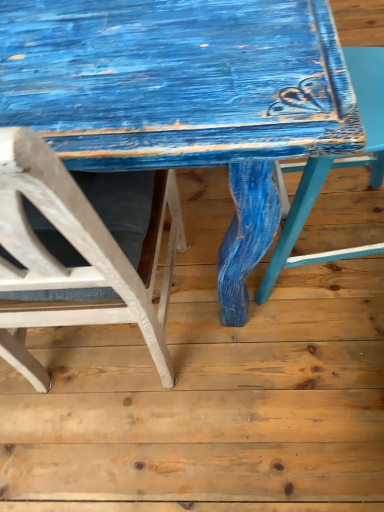
Question: Is matte blue chair at right, which is the first chair in right-to-left order, smaller than distressed blue wood table at center?

Choices:
 (A) yes
 (B) no

Answer: (A)

Question: Is matte blue chair at right, which is the 2th chair from left to right, closer to the viewer compared to distressed blue wood table at center?

Choices:
 (A) no
 (B) yes

Answer: (B)

Question: Does matte blue chair at right, which is the 2th chair from left to right, appear on the left side of distressed blue wood table at center?

Choices:
 (A) no
 (B) yes

Answer: (A)

Question: From the image's perspective, is matte blue chair at right, which is the 2th chair from left to right, located above distressed blue wood table at center?

Choices:
 (A) yes
 (B) no

Answer: (B)

Question: From the image's perspective, is matte blue chair at right, which is the 2th chair from left to right, located beneath distressed blue wood table at center?

Choices:
 (A) yes
 (B) no

Answer: (A)

Question: Is matte blue chair at right, which is the 2th chair from left to right, taller than distressed blue wood table at center?

Choices:
 (A) yes
 (B) no

Answer: (A)

Question: Is white matte chair at left, placed as the second chair when sorted from right to left, closer to the viewer compared to matte blue chair at right, which is the 2th chair from left to right?

Choices:
 (A) yes
 (B) no

Answer: (A)

Question: Does white matte chair at left, placed as the first chair when sorted from left to right, have a larger size compared to matte blue chair at right, which is the first chair in right-to-left order?

Choices:
 (A) no
 (B) yes

Answer: (B)

Question: Is white matte chair at left, placed as the second chair when sorted from right to left, thinner than matte blue chair at right, which is the first chair in right-to-left order?

Choices:
 (A) yes
 (B) no

Answer: (B)

Question: Does white matte chair at left, placed as the second chair when sorted from right to left, appear on the left side of matte blue chair at right, which is the first chair in right-to-left order?

Choices:
 (A) no
 (B) yes

Answer: (B)

Question: Does white matte chair at left, placed as the second chair when sorted from right to left, have a greater width compared to matte blue chair at right, which is the 2th chair from left to right?

Choices:
 (A) yes
 (B) no

Answer: (A)

Question: Are white matte chair at left, placed as the first chair when sorted from left to right, and matte blue chair at right, which is the first chair in right-to-left order, located far from each other?

Choices:
 (A) no
 (B) yes

Answer: (A)

Question: Is distressed blue wood table at center shorter than white matte chair at left, placed as the second chair when sorted from right to left?

Choices:
 (A) no
 (B) yes

Answer: (B)